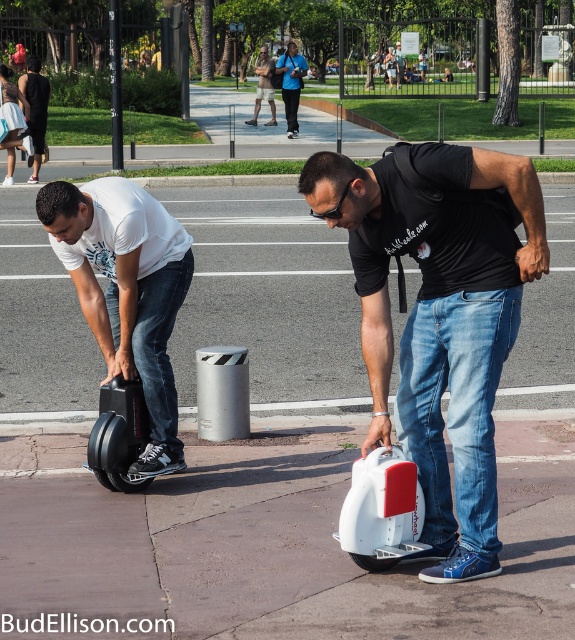
You are a delivery drone operator. Your drone is currently at the center of the image. You need to deliver a package to the black matte scooter at lower left. What is the direction you should fly to reach the scooter?

The black matte scooter at lower left is located at point (118, 435). Since the drone is at the center, it should fly downward and to the right to reach the scooter.

You are a delivery drone flying over an urban park. You need to land on either the smooth concrete sidewalk at center or the khaki cotton shorts at center. Which surface is safer to land on based on their sizes?

The smooth concrete sidewalk at center is shorter than the khaki cotton shorts at center, so the khaki cotton shorts at center would provide a larger and safer landing area for the drone.